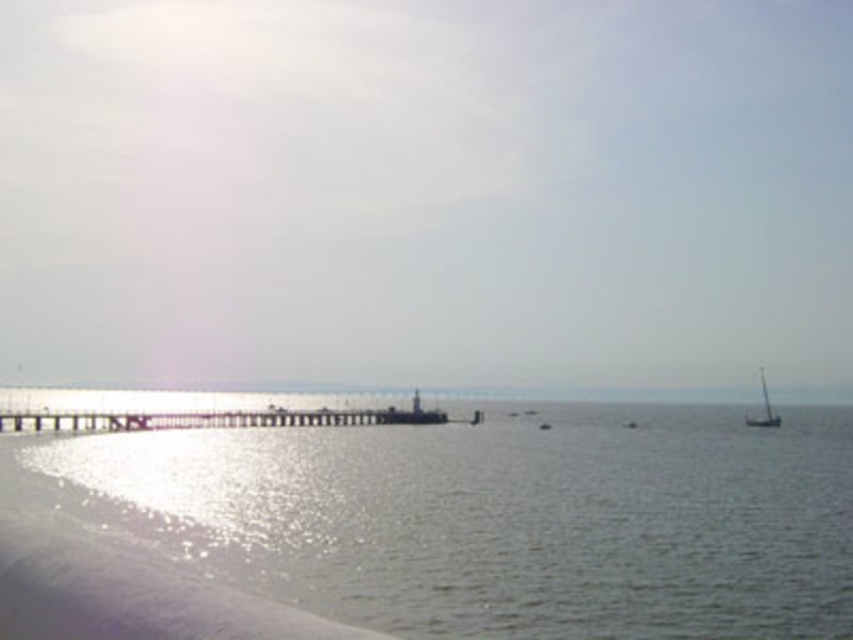
Question: Which of the following is the farthest from the observer?

Choices:
 (A) white matte sailboat at right
 (B) smooth glass water at center
 (C) wooden pier at center
 (D) shiny silver water at lower left

Answer: (B)

Question: Does wooden pier at center appear over white matte sailboat at right?

Choices:
 (A) no
 (B) yes

Answer: (B)

Question: Which object is the farthest from the white matte sailboat at right?

Choices:
 (A) smooth glass water at center
 (B) wooden pier at center

Answer: (A)

Question: Can you confirm if wooden pier at center is positioned to the left of white matte sailboat at right?

Choices:
 (A) no
 (B) yes

Answer: (B)

Question: Which point is closer to the camera?

Choices:
 (A) smooth glass water at center
 (B) white matte sailboat at right
 (C) wooden pier at center
 (D) shiny silver water at lower left

Answer: (D)

Question: Does shiny silver water at lower left have a larger size compared to smooth glass water at center?

Choices:
 (A) no
 (B) yes

Answer: (A)